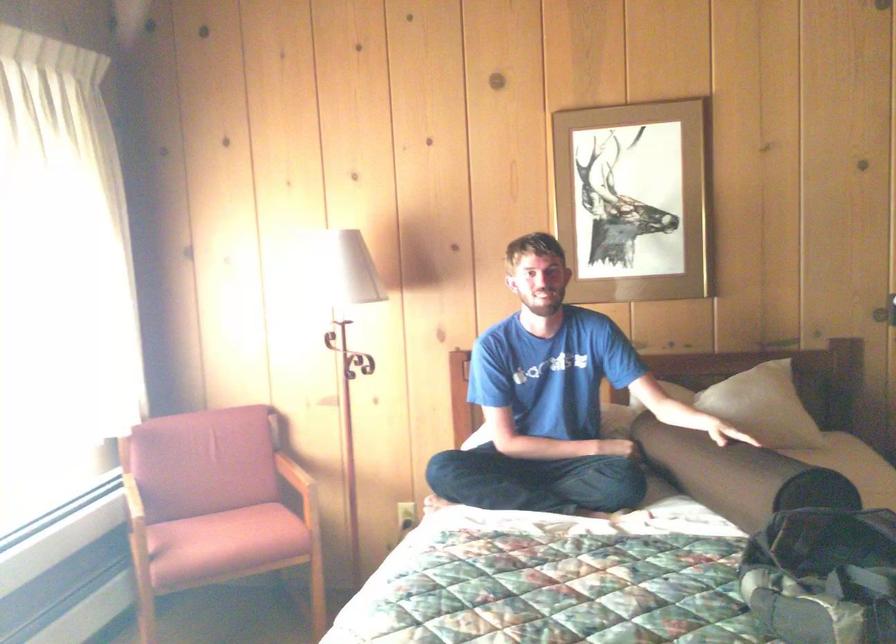
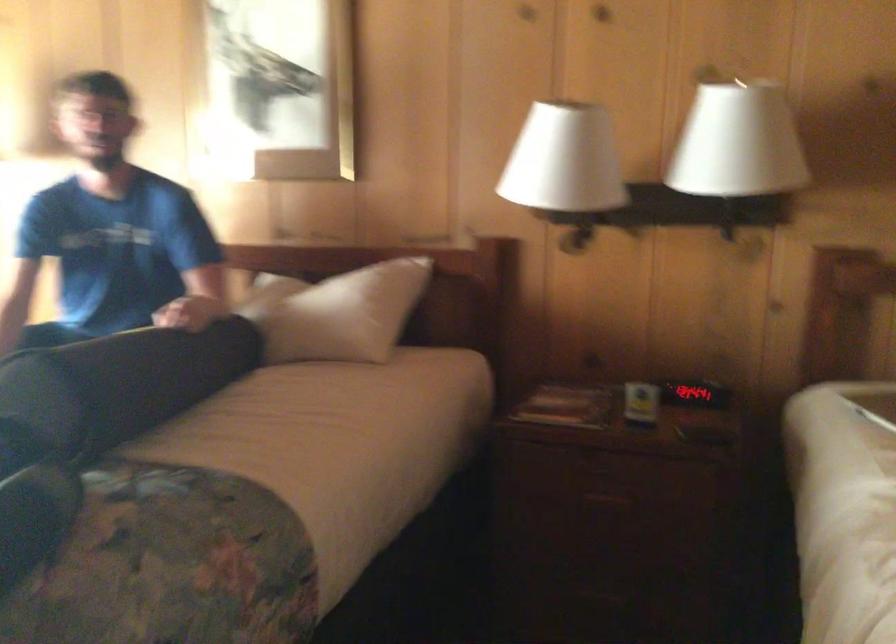
Question: The images are taken continuously from a first-person perspective. In which direction are you moving?

Choices:
 (A) Left
 (B) Right
 (C) Forward
 (D) Backward

Answer: (B)